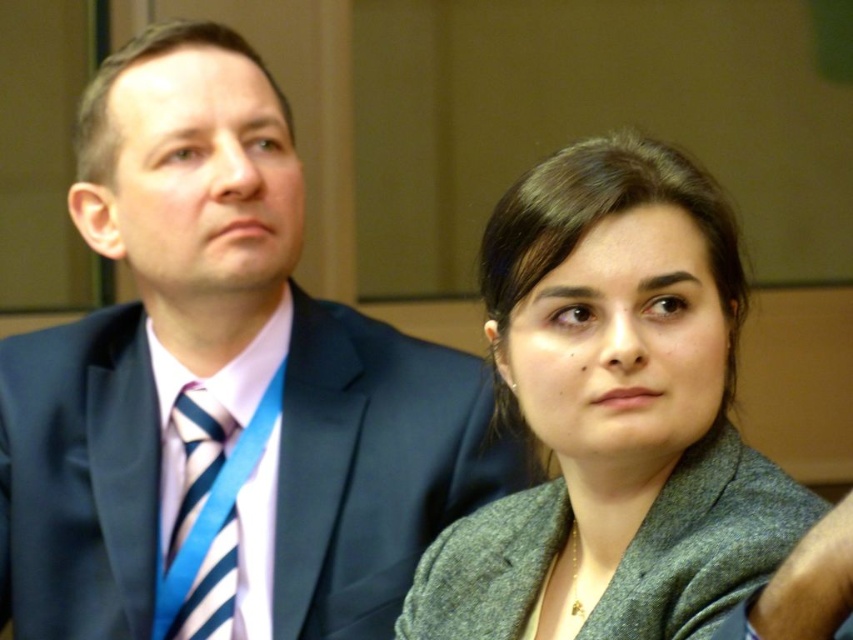
Can you confirm if dark blue suit at left is smaller than gray woolen jacket at center?

Actually, dark blue suit at left might be larger than gray woolen jacket at center.

Can you confirm if dark blue suit at left is shorter than gray woolen jacket at center?

No.

Does point (270, 282) come closer to viewer compared to point (733, 433)?

No, (270, 282) is behind (733, 433).

This screenshot has width=853, height=640. I want to click on dark blue suit at left, so click(x=221, y=387).

Between point (317, 509) and point (183, 438), which one is positioned behind?

The point (183, 438) is more distant.

Can you confirm if dark blue suit at left is positioned to the right of striped fabric tie at left?

Correct, you'll find dark blue suit at left to the right of striped fabric tie at left.

Is point (297, 404) positioned behind point (196, 580)?

Yes.

You are a GUI agent. You are given a task and a screenshot of the screen. Output one action in this format:
    pyautogui.click(x=<x>, y=<y>)
    Task: Click on the dark blue suit at left
    The width and height of the screenshot is (853, 640).
    Given the screenshot: What is the action you would take?
    pyautogui.click(x=221, y=387)

Can you confirm if gray woolen jacket at center is positioned to the left of striped fabric tie at left?

In fact, gray woolen jacket at center is to the right of striped fabric tie at left.

Locate an element on the screen. The image size is (853, 640). gray woolen jacket at center is located at coordinates (613, 413).

The width and height of the screenshot is (853, 640). I want to click on gray woolen jacket at center, so click(x=613, y=413).